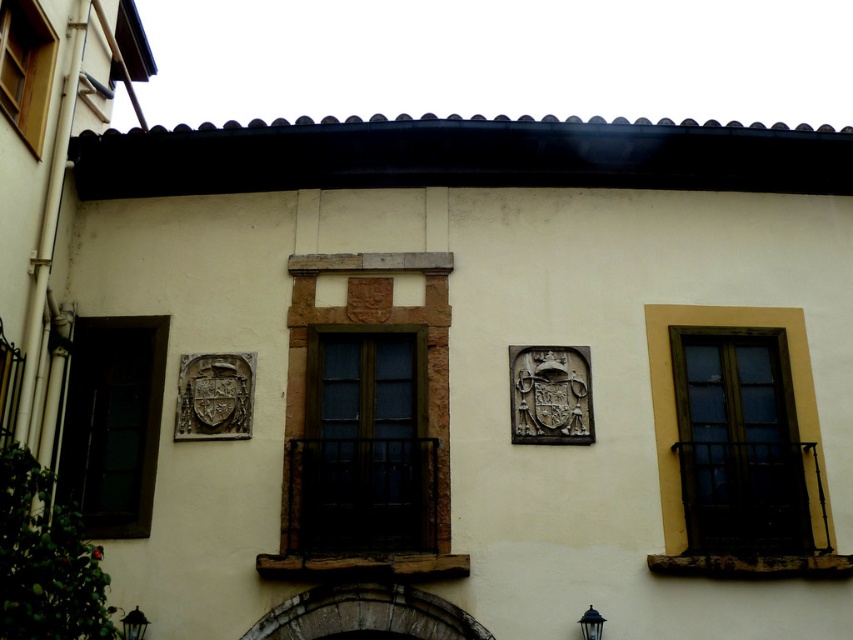
Is the position of matte glass window at right less distant than that of dark glass window at left?

Yes.

Can you confirm if matte glass window at right is bigger than dark glass window at left?

Yes.

Between point (811, 550) and point (94, 474), which one is positioned behind?

The point (94, 474) is more distant.

Locate an element on the screen. The width and height of the screenshot is (853, 640). matte glass window at right is located at coordinates (740, 442).

In the scene shown: Is brown wooden window at center wider than dark glass window at left?

Indeed, brown wooden window at center has a greater width compared to dark glass window at left.

Find the location of `brown wooden window at center`. brown wooden window at center is located at coordinates (364, 444).

Which is below, brown wooden window at center or wooden window at upper left?

brown wooden window at center is below.

Is point (383, 348) closer to viewer compared to point (9, 112)?

No, it is behind (9, 112).

Identify the location of brown wooden window at center. Image resolution: width=853 pixels, height=640 pixels. (364, 444).